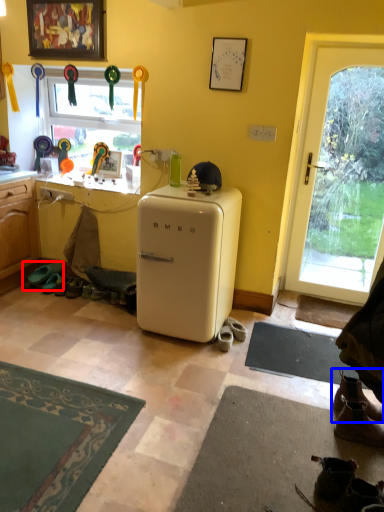
Question: Among these objects, which one is farthest to the camera, footwear (highlighted by a red box) or footwear (highlighted by a blue box)?

Choices:
 (A) footwear
 (B) footwear

Answer: (A)